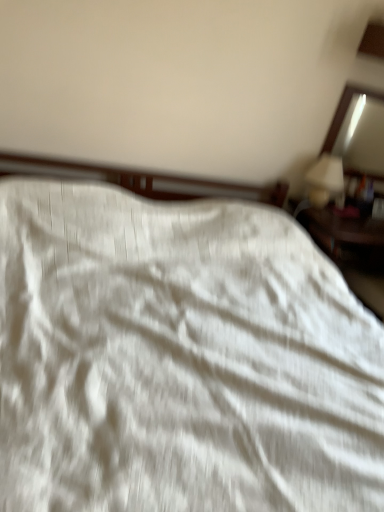
Question: Can you confirm if white glossy table lamp at upper right is bigger than white textured fabric at center?

Choices:
 (A) no
 (B) yes

Answer: (A)

Question: Can you confirm if white glossy table lamp at upper right is taller than white textured fabric at center?

Choices:
 (A) no
 (B) yes

Answer: (A)

Question: Could you tell me if white glossy table lamp at upper right is turned towards white textured fabric at center?

Choices:
 (A) no
 (B) yes

Answer: (A)

Question: From the image's perspective, is white glossy table lamp at upper right located beneath white textured fabric at center?

Choices:
 (A) yes
 (B) no

Answer: (B)

Question: Considering the relative sizes of white glossy table lamp at upper right and white textured fabric at center in the image provided, is white glossy table lamp at upper right shorter than white textured fabric at center?

Choices:
 (A) no
 (B) yes

Answer: (B)

Question: From the image's perspective, is white glossy table lamp at upper right on white textured fabric at center?

Choices:
 (A) yes
 (B) no

Answer: (A)

Question: Is white textured fabric at center looking in the opposite direction of matte wooden mirror at upper right?

Choices:
 (A) no
 (B) yes

Answer: (A)

Question: From the image's perspective, is white textured fabric at center on top of matte wooden mirror at upper right?

Choices:
 (A) no
 (B) yes

Answer: (A)

Question: Is white textured fabric at center in front of matte wooden mirror at upper right?

Choices:
 (A) yes
 (B) no

Answer: (A)

Question: From a real-world perspective, is white textured fabric at center located beneath matte wooden mirror at upper right?

Choices:
 (A) yes
 (B) no

Answer: (A)

Question: Can you confirm if white textured fabric at center is taller than matte wooden mirror at upper right?

Choices:
 (A) yes
 (B) no

Answer: (A)

Question: Is white textured fabric at center behind matte wooden mirror at upper right?

Choices:
 (A) yes
 (B) no

Answer: (B)

Question: Is matte wooden mirror at upper right oriented towards white glossy table lamp at upper right?

Choices:
 (A) no
 (B) yes

Answer: (B)